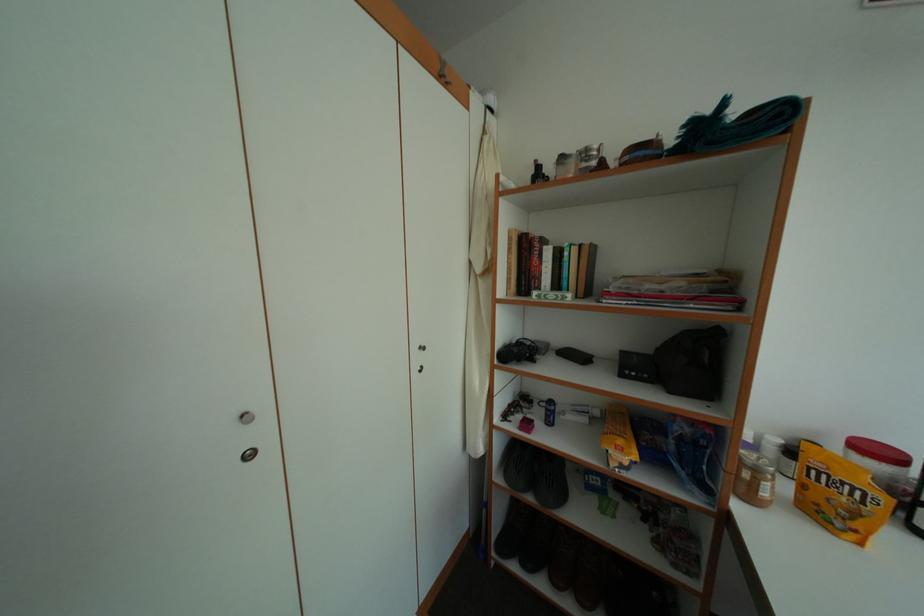
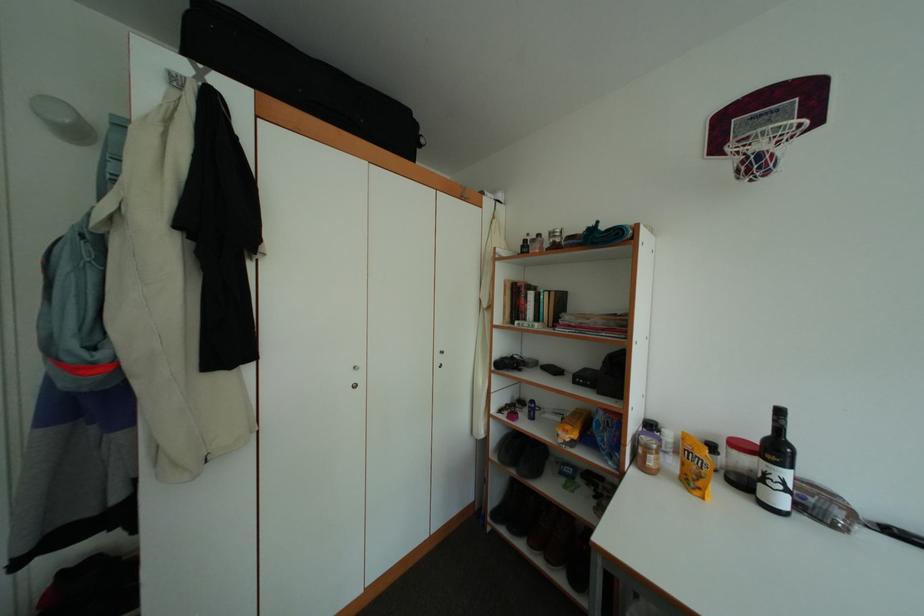
What movement of the cameraman would produce the second image?

The cameraman walked toward right, backward.